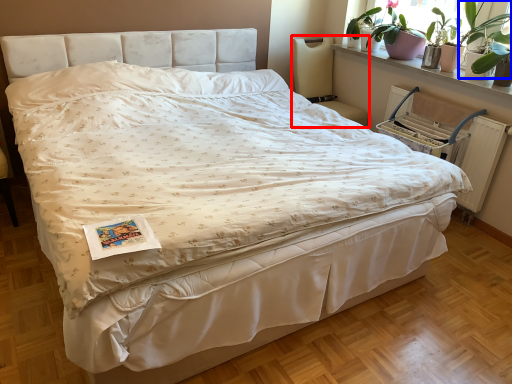
Question: Which object appears farthest to the camera in this image, chair (highlighted by a red box) or plant (highlighted by a blue box)?

Choices:
 (A) chair
 (B) plant

Answer: (A)